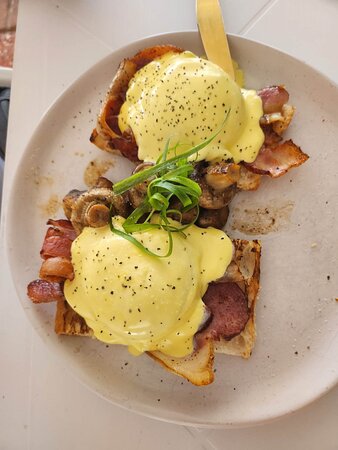
This screenshot has height=450, width=338. What are the coordinates of `plate` in the screenshot? It's located at (57, 156).